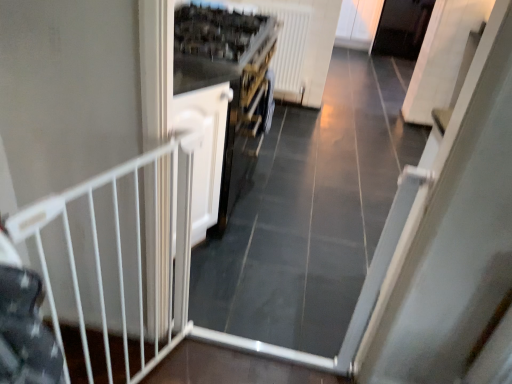
Question: Would you say white matte door at center is to the left or to the right of white metal gate at left in the picture?

Choices:
 (A) right
 (B) left

Answer: (A)

Question: Is white matte door at center wider or thinner than white metal gate at left?

Choices:
 (A) wide
 (B) thin

Answer: (A)

Question: Estimate the real-world distances between objects in this image. Which object is farther from the white plastic radiator at upper center?

Choices:
 (A) white matte door at center
 (B) white metal gate at left

Answer: (B)

Question: Considering the real-world distances, which object is closest to the white matte door at center?

Choices:
 (A) white plastic radiator at upper center
 (B) white metal gate at left

Answer: (B)